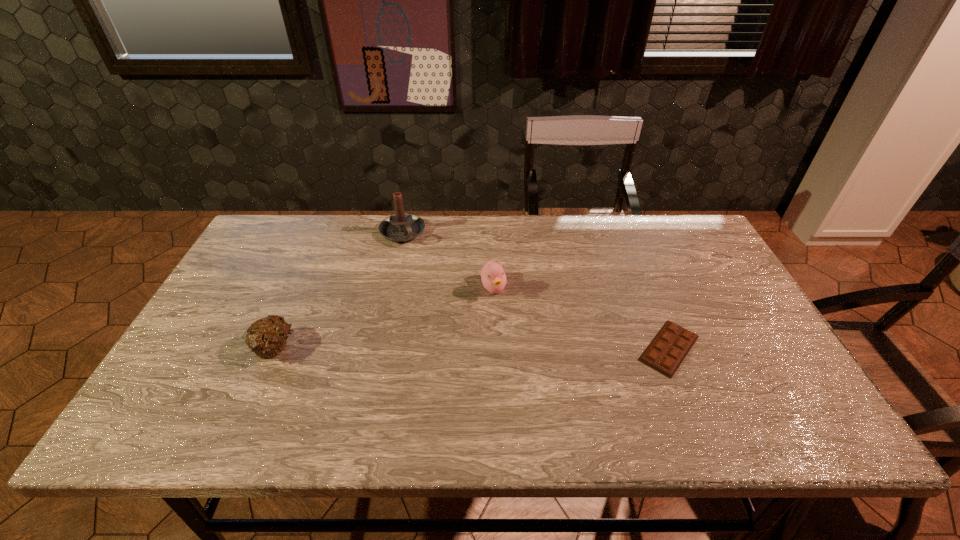
Identify the location of the leftmost object. This screenshot has width=960, height=540. (266, 338).

Where is `the third tallest object`? The height and width of the screenshot is (540, 960). the third tallest object is located at coordinates (266, 338).

This screenshot has width=960, height=540. What are the coordinates of `chocolate bar` in the screenshot? It's located at (665, 353).

This screenshot has height=540, width=960. I want to click on the rightmost object, so click(x=665, y=353).

Locate an element on the screen. The width and height of the screenshot is (960, 540). the second tallest object is located at coordinates (493, 277).

Identify the location of the third object from left to right. (493, 277).

Identify the location of the tallest object. pos(400,227).

Where is `the farthest object`? This screenshot has height=540, width=960. the farthest object is located at coordinates (400, 227).

Locate an element on the screen. Image resolution: width=960 pixels, height=540 pixels. free location located 0.110m on the right of the muffin is located at coordinates (339, 347).

The height and width of the screenshot is (540, 960). Identify the location of vacant region located on the back of the shortest object. (635, 264).